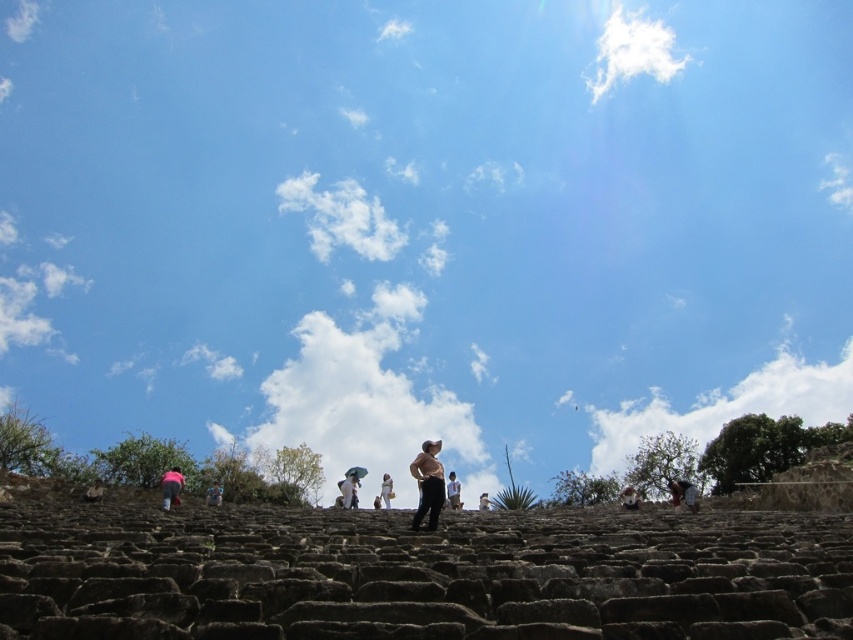
Question: Does dark brown leather pants at center have a greater width compared to light brown fabric bag at center?

Choices:
 (A) yes
 (B) no

Answer: (A)

Question: Based on their relative distances, which object is farther from the brown leather jacket at center?

Choices:
 (A) light brown fabric bag at center
 (B) matte black pants at center
 (C) white fabric umbrella at center

Answer: (C)

Question: Does pink fabric at lower center have a lesser width compared to light brown stone person at center?

Choices:
 (A) yes
 (B) no

Answer: (B)

Question: Can you confirm if light brown fabric bag at center is positioned to the right of pink fabric at lower center?

Choices:
 (A) yes
 (B) no

Answer: (A)

Question: Which point is farther from the camera taking this photo?

Choices:
 (A) (660, 515)
 (B) (457, 484)

Answer: (B)

Question: Among these objects, which one is farthest from the camera?

Choices:
 (A) dark brown leather pants at center
 (B) matte black pants at center

Answer: (A)